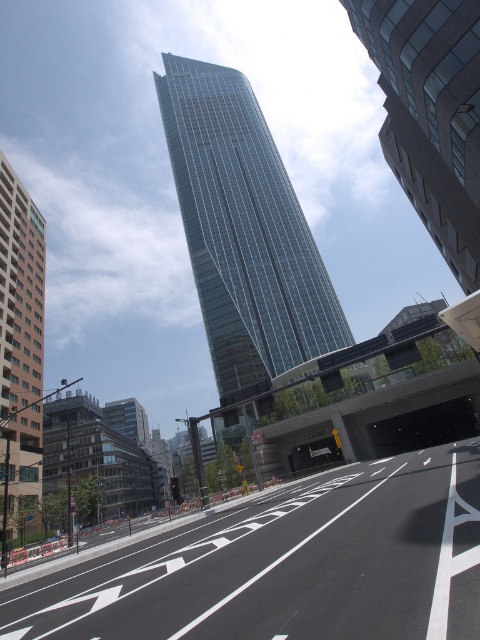
Question: Which point is farther from the camera taking this photo?

Choices:
 (A) (380, 38)
 (B) (275, 276)

Answer: (B)

Question: Is glassy metallic skyscraper at center positioned at the back of beige concrete building at left?

Choices:
 (A) no
 (B) yes

Answer: (B)

Question: Which object is positioned farthest from the glassy metallic skyscraper at center?

Choices:
 (A) beige concrete building at left
 (B) glassy reflective skyscraper at center

Answer: (B)

Question: Does glassy metallic skyscraper at center have a greater width compared to beige concrete building at left?

Choices:
 (A) yes
 (B) no

Answer: (A)

Question: Which object is the farthest from the glassy metallic skyscraper at center?

Choices:
 (A) beige concrete building at left
 (B) glassy reflective skyscraper at center

Answer: (B)

Question: Does glassy metallic skyscraper at center appear on the left side of glassy reflective skyscraper at center?

Choices:
 (A) no
 (B) yes

Answer: (B)